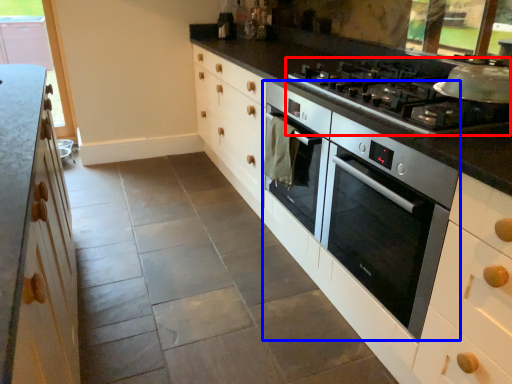
Question: Which point is further to the camera, gas stove (highlighted by a red box) or home appliance (highlighted by a blue box)?

Choices:
 (A) gas stove
 (B) home appliance

Answer: (A)